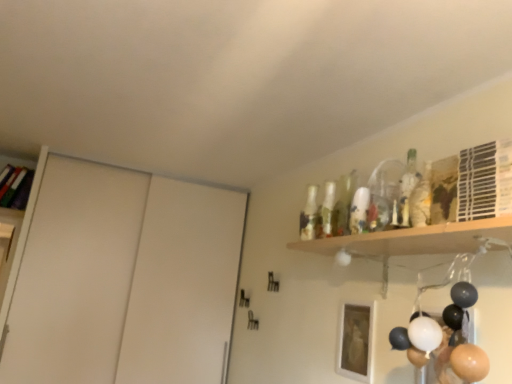
Question: Is point pos(485,168) positioned closer to the camera than point pos(464,379)?

Choices:
 (A) closer
 (B) farther

Answer: (A)

Question: From a real-world perspective, is white plastic shelf at upper right, which is the first shelf in right-to-left order, positioned above or below matte black balloons at lower right?

Choices:
 (A) below
 (B) above

Answer: (B)

Question: Estimate the real-world distances between objects in this image. Which object is closer to the wooden bookshelf at upper left, the 1th shelf viewed from the left?

Choices:
 (A) white plastic shelf at upper right, the second shelf in the back-to-front sequence
 (B) matte black balloons at lower right
 (C) white matte sliding door at left
 (D) white matte picture frame at lower center

Answer: (C)

Question: Estimate the real-world distances between objects in this image. Which object is closer to the white matte picture frame at lower center?

Choices:
 (A) white plastic shelf at upper right, which is counted as the 2th shelf, starting from the left
 (B) wooden bookshelf at upper left, the 2th shelf viewed from the front
 (C) matte black balloons at lower right
 (D) white matte sliding door at left

Answer: (C)